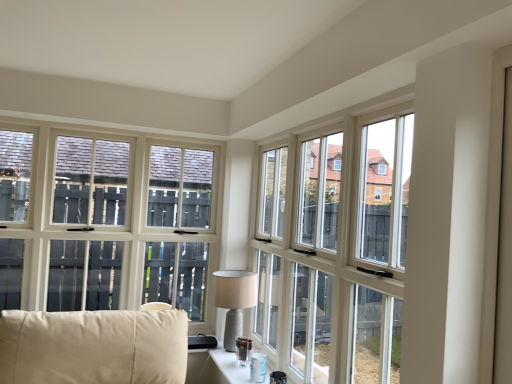
Question: Does matte gray lamp at center have a larger size compared to clear glass table at lower center?

Choices:
 (A) no
 (B) yes

Answer: (B)

Question: Can we say matte gray lamp at center lies outside clear glass table at lower center?

Choices:
 (A) no
 (B) yes

Answer: (B)

Question: Considering the relative sizes of matte gray lamp at center and clear glass table at lower center in the image provided, is matte gray lamp at center smaller than clear glass table at lower center?

Choices:
 (A) yes
 (B) no

Answer: (B)

Question: Is matte gray lamp at center shorter than clear glass table at lower center?

Choices:
 (A) no
 (B) yes

Answer: (A)

Question: From a real-world perspective, is matte gray lamp at center under clear glass table at lower center?

Choices:
 (A) yes
 (B) no

Answer: (B)

Question: Is matte gray lamp at center closer to the viewer compared to clear glass table at lower center?

Choices:
 (A) no
 (B) yes

Answer: (A)

Question: Is matte gray lamp at center smaller than transparent glass window at center?

Choices:
 (A) no
 (B) yes

Answer: (B)

Question: Does matte gray lamp at center have a lesser width compared to transparent glass window at center?

Choices:
 (A) no
 (B) yes

Answer: (A)

Question: Is there a large distance between matte gray lamp at center and transparent glass window at center?

Choices:
 (A) yes
 (B) no

Answer: (B)

Question: Is matte gray lamp at center in contact with transparent glass window at center?

Choices:
 (A) yes
 (B) no

Answer: (B)

Question: From the image's perspective, is matte gray lamp at center below transparent glass window at center?

Choices:
 (A) no
 (B) yes

Answer: (B)

Question: Could you tell me if matte gray lamp at center is facing transparent glass window at center?

Choices:
 (A) yes
 (B) no

Answer: (A)

Question: Does transparent glass window at center have a lesser height compared to clear glass table at lower center?

Choices:
 (A) yes
 (B) no

Answer: (B)